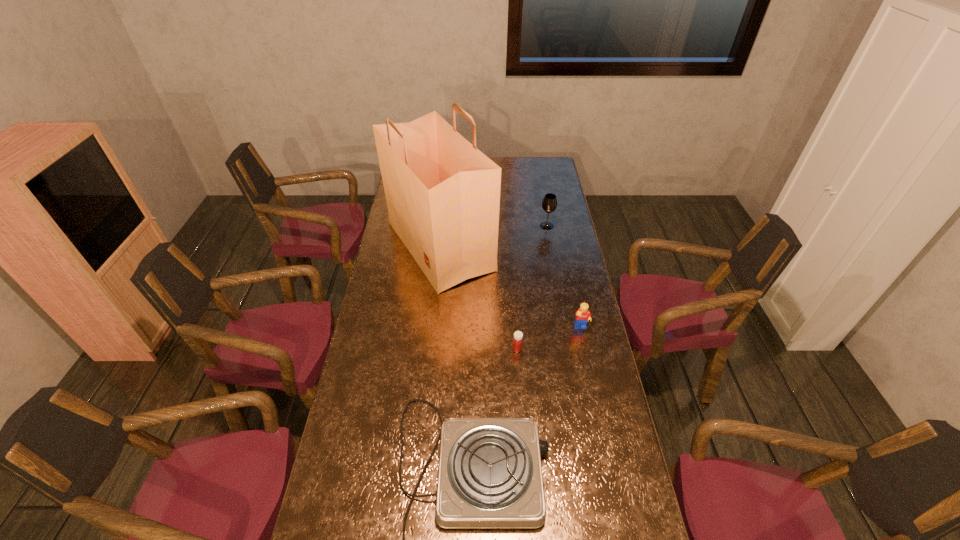
Locate an element on the screen. The width and height of the screenshot is (960, 540). grocery bag is located at coordinates (443, 194).

Identify the location of the fourth shortest object. The image size is (960, 540). (549, 204).

The height and width of the screenshot is (540, 960). In order to click on the third nearest object in this screenshot , I will do pyautogui.click(x=583, y=314).

Find the location of a particular element. This screenshot has width=960, height=540. the third tallest object is located at coordinates (583, 314).

At what (x,y) coordinates should I click in order to perform the action: click on medicine. Please return your answer as a coordinate pair (x, y). Image resolution: width=960 pixels, height=540 pixels. Looking at the image, I should click on (517, 343).

I want to click on the second nearest object, so click(517, 343).

Find the location of a particular element. This screenshot has height=540, width=960. vacant space located on the side of the grocery bag with the superhero design is located at coordinates (572, 246).

Image resolution: width=960 pixels, height=540 pixels. I want to click on free space located 0.070m on the back of the wineglass, so click(x=544, y=213).

At what (x,y) coordinates should I click in order to perform the action: click on vacant space located on the face of the third farthest object. Please return your answer as a coordinate pair (x, y). Looking at the image, I should click on (585, 347).

Find the location of a particular element. The image size is (960, 540). vacant space located 0.140m on the back of the second shortest object is located at coordinates (515, 315).